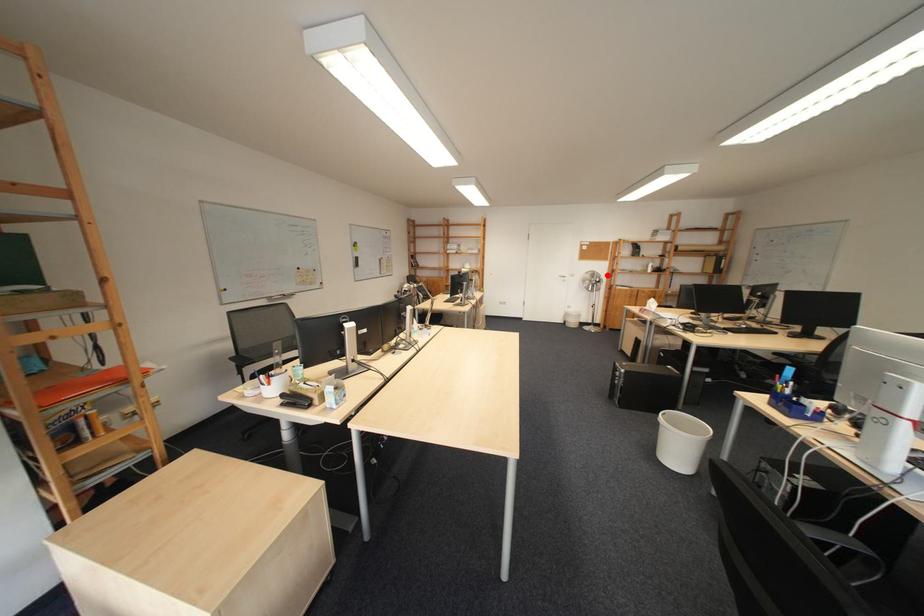
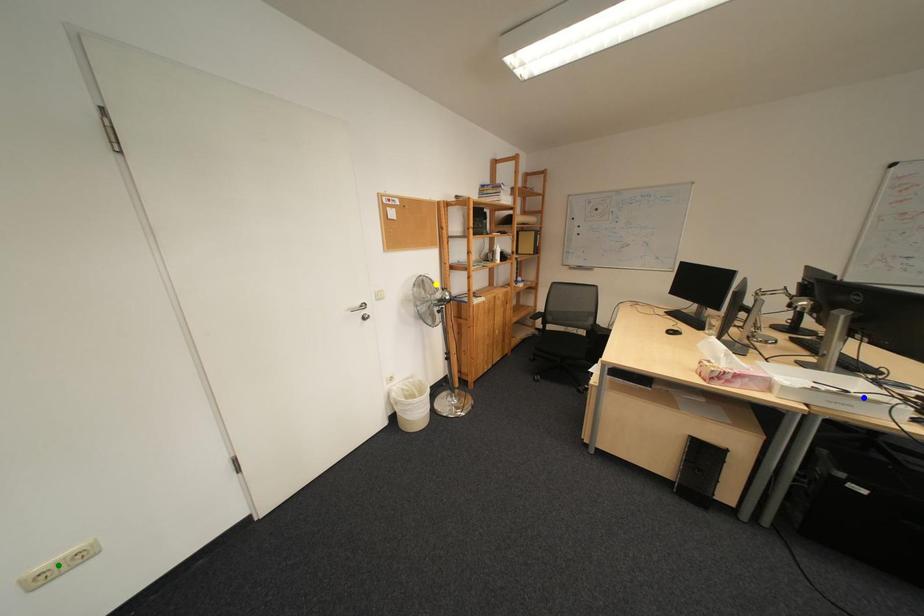
Question: I am providing you with two images of the same scene from different viewpoints. A red point is marked on the first image. You are given multiple points on the second image. Which point in image 2 is actually the same real-world point as the red point in image 1?

Choices:
 (A) green point
 (B) blue point
 (C) yellow point

Answer: (C)